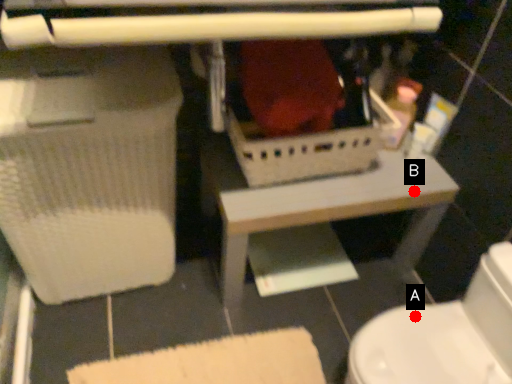
Question: Two points are circled on the image, labeled by A and B beside each circle. Which point appears farthest from the camera in this image?

Choices:
 (A) A is further
 (B) B is further

Answer: (B)